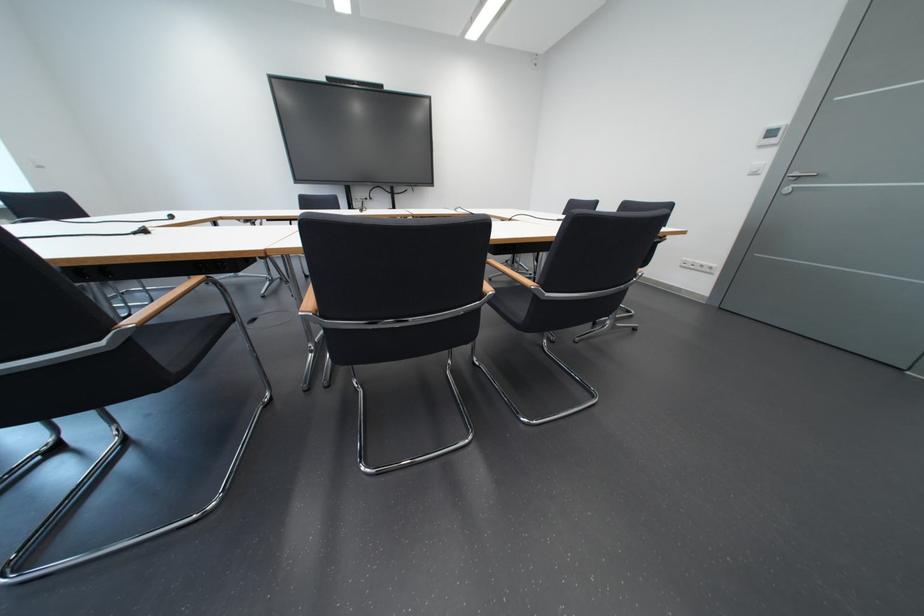
Where is `wooden chair armrest`? The width and height of the screenshot is (924, 616). wooden chair armrest is located at coordinates (162, 302).